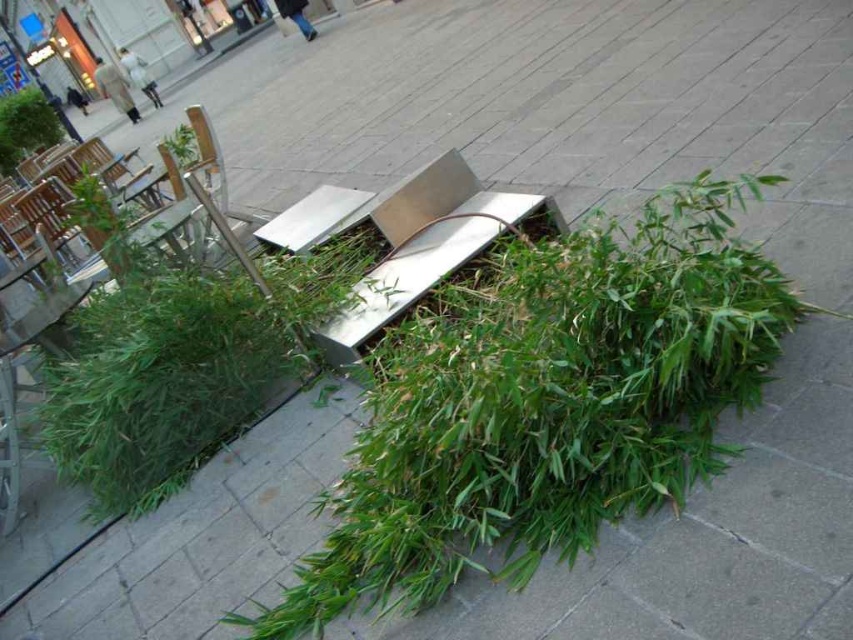
Does stainless steel bench at center appear over green leafy plant at upper left?

Incorrect, stainless steel bench at center is not positioned above green leafy plant at upper left.

Does point (421, 200) come in front of point (32, 136)?

Yes, it is in front of point (32, 136).

This screenshot has height=640, width=853. Identify the location of stainless steel bench at center. (404, 237).